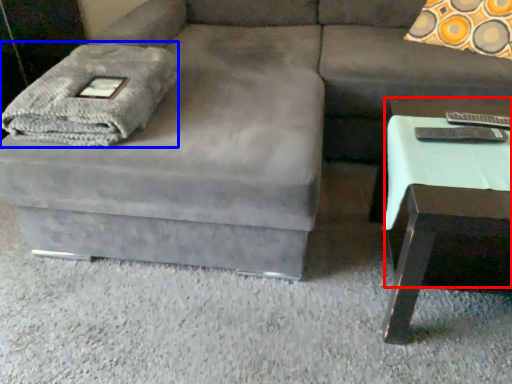
Question: Among these objects, which one is nearest to the camera, side table (highlighted by a red box) or blanket (highlighted by a blue box)?

Choices:
 (A) side table
 (B) blanket

Answer: (A)